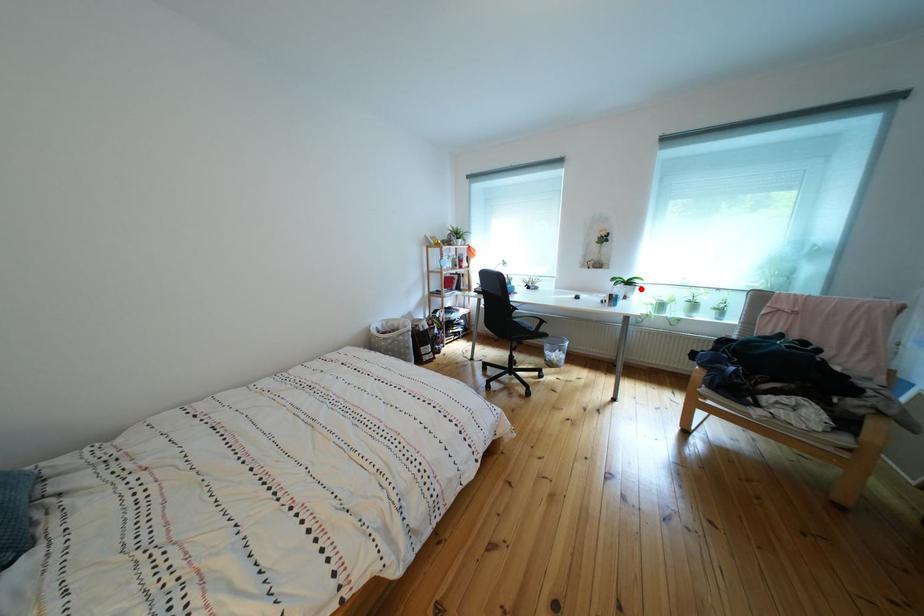
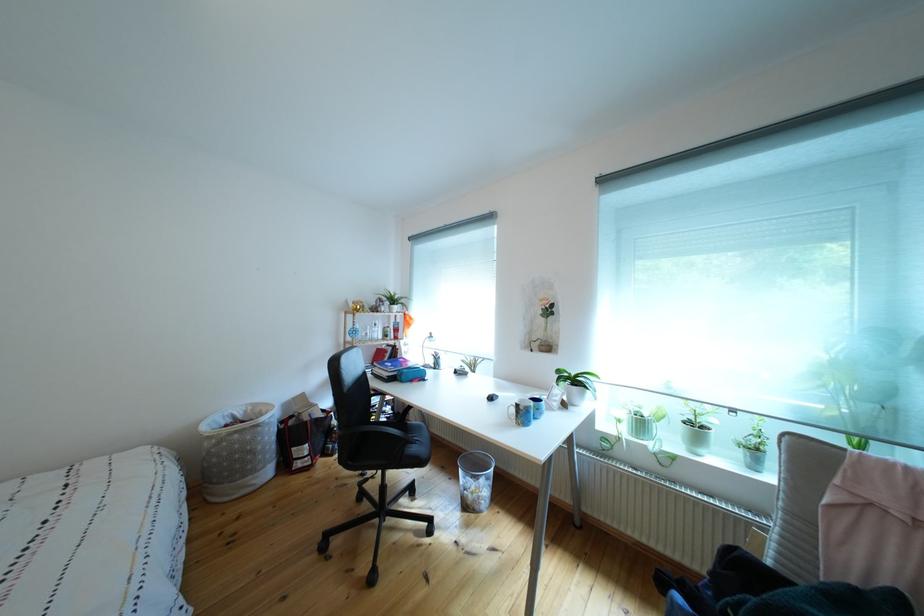
Question: A red point is marked in image1. In image2, is the corresponding 3D point closer to the camera or farther? Reply with the corresponding letter.

Choices:
 (A) The corresponding 3D point is closer.
 (B) The corresponding 3D point is farther.

Answer: (B)